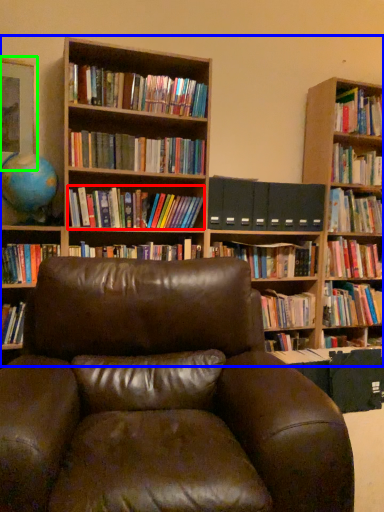
Question: Which object is positioned closest to book (highlighted by a red box)? Select from bookcase (highlighted by a blue box) and picture frame (highlighted by a green box).

Choices:
 (A) bookcase
 (B) picture frame

Answer: (A)